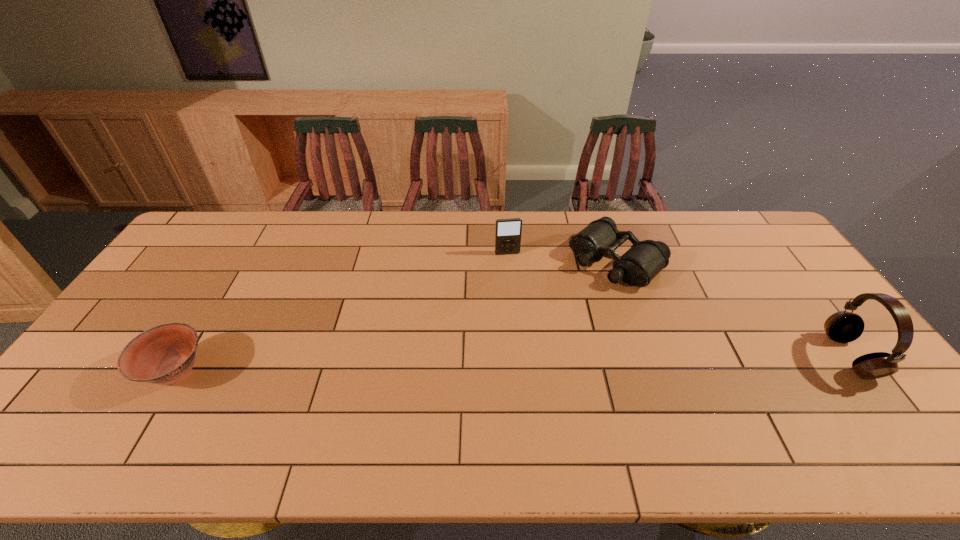
Where is `free space between the iPod and the leftmost object`? free space between the iPod and the leftmost object is located at coordinates (342, 313).

Locate an element on the screen. blank region between the rightmost object and the leftmost object is located at coordinates (513, 364).

Find the location of `unoccupied area between the headset and the bowl`. unoccupied area between the headset and the bowl is located at coordinates (513, 364).

Image resolution: width=960 pixels, height=540 pixels. What are the coordinates of `free space between the binoculars and the leftmost object` in the screenshot? It's located at (396, 316).

Locate which object is the second closest to the third object from right to left. Please provide its 2D coordinates. Your answer should be formatted as a tuple, i.e. [(x, y)], where the tuple contains the x and y coordinates of a point satisfying the conditions above.

[(165, 354)]

Image resolution: width=960 pixels, height=540 pixels. Identify the location of object that ranks as the second closest to the leftmost object. (645, 259).

Find the location of a particular element. Image resolution: width=960 pixels, height=540 pixels. vacant space that satisfies the following two spatial constraints: 1. on the back side of the iPod; 2. on the right side of the leftmost object is located at coordinates (247, 253).

Find the location of `vacant space that satisfies the following two spatial constraints: 1. on the front side of the iPod; 2. on the ear pads of the rightmost object`. vacant space that satisfies the following two spatial constraints: 1. on the front side of the iPod; 2. on the ear pads of the rightmost object is located at coordinates (515, 356).